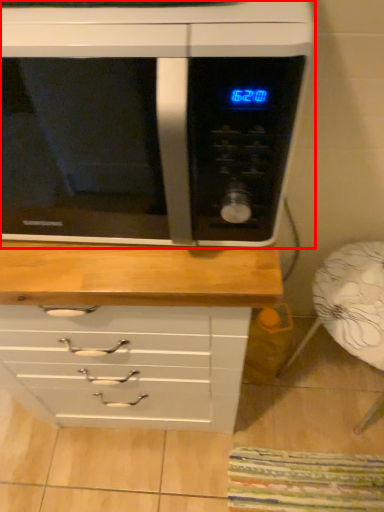
Question: From the image's perspective, where is microwave oven (annotated by the red box) located relative to armchair?

Choices:
 (A) below
 (B) above

Answer: (B)